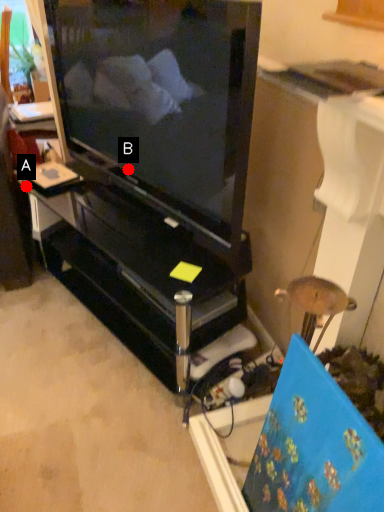
Question: Two points are circled on the image, labeled by A and B beside each circle. Which point appears closest to the camera in this image?

Choices:
 (A) A is closer
 (B) B is closer

Answer: (B)